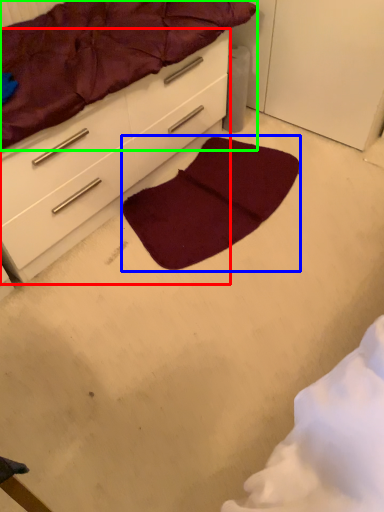
Question: Which object is positioned farthest from chest of drawers (highlighted by a red box)? Select from mat (highlighted by a blue box) and mattress (highlighted by a green box).

Choices:
 (A) mat
 (B) mattress

Answer: (A)